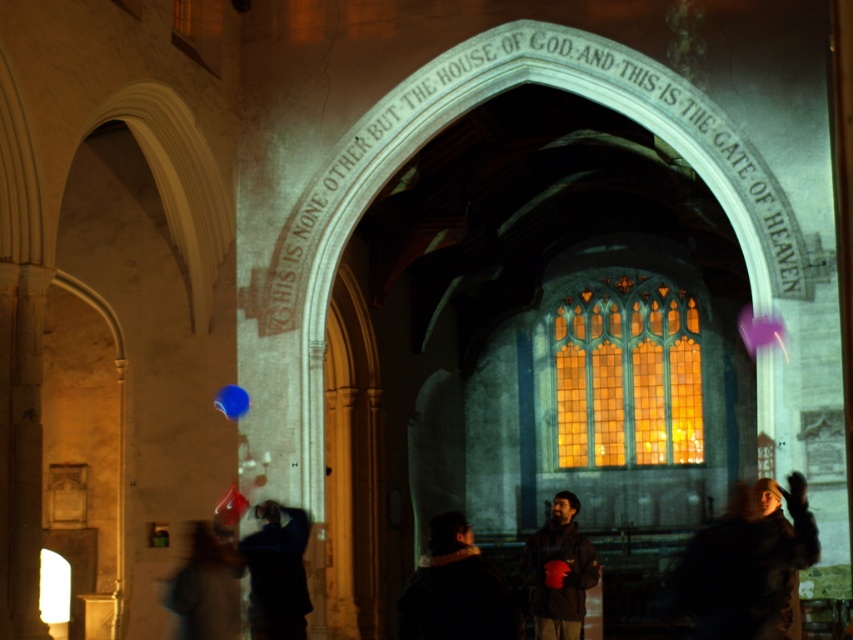
Question: Observing the image, what is the correct spatial positioning of dark brown leather jacket at lower right in reference to dark fabric jacket at lower center?

Choices:
 (A) above
 (B) below

Answer: (A)

Question: Among these objects, which one is nearest to the camera?

Choices:
 (A) rubber balloon at lower center
 (B) translucent plastic balloon at lower left
 (C) dark fabric jacket at center

Answer: (C)

Question: Estimate the real-world distances between objects in this image. Which object is farther from the rubber balloon at lower center?

Choices:
 (A) dark fabric jacket at center
 (B) dark brown leather jacket at center

Answer: (A)

Question: Can you confirm if dark fabric jacket at center is positioned below rubber balloon at lower center?

Choices:
 (A) no
 (B) yes

Answer: (A)

Question: Can you confirm if dark brown leather jacket at center is positioned below rubber balloon at lower center?

Choices:
 (A) no
 (B) yes

Answer: (B)

Question: Which is nearer to the dark fabric jacket at center?

Choices:
 (A) rubber balloon at lower center
 (B) translucent plastic balloon at lower left

Answer: (B)